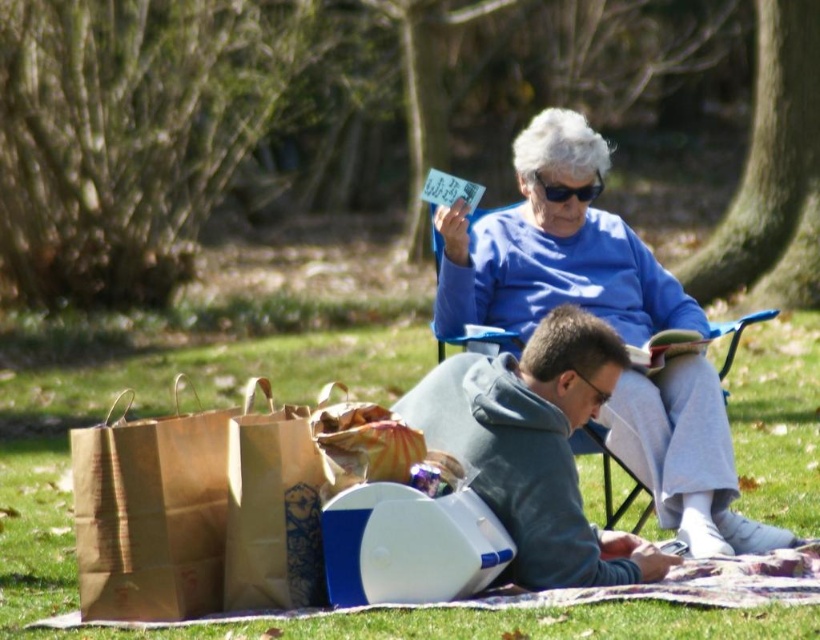
In the scene shown: Can you confirm if blue cotton sweater at upper center is positioned below blue fabric chair at upper center?

No, blue cotton sweater at upper center is not below blue fabric chair at upper center.

Does point (697, 484) come farther from viewer compared to point (481, 330)?

No, it is in front of (481, 330).

The image size is (820, 640). Identify the location of blue cotton sweater at upper center. (554, 248).

Does green grass at lower center appear on the right side of gray fleece hoodie at lower center?

Indeed, green grass at lower center is positioned on the right side of gray fleece hoodie at lower center.

Is point (481, 637) behind point (622, 552)?

No, it is in front of (622, 552).

What are the coordinates of `green grass at lower center` in the screenshot? It's located at click(153, 413).

Does green grass at lower center appear under brown paper bag at lower left?

Yes, green grass at lower center is below brown paper bag at lower left.

Does green grass at lower center have a lesser height compared to brown paper bag at lower left?

Result: Indeed, green grass at lower center has a lesser height compared to brown paper bag at lower left.

Is point (172, 630) in front of point (93, 538)?

Yes, point (172, 630) is in front of point (93, 538).

The width and height of the screenshot is (820, 640). In order to click on green grass at lower center in this screenshot , I will do `click(153, 413)`.